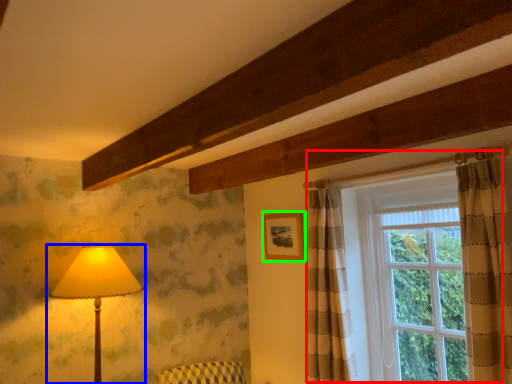
Question: Based on their relative distances, which object is farther from window (highlighted by a red box)? Choose from lamp (highlighted by a blue box) and picture frame (highlighted by a green box).

Choices:
 (A) lamp
 (B) picture frame

Answer: (A)